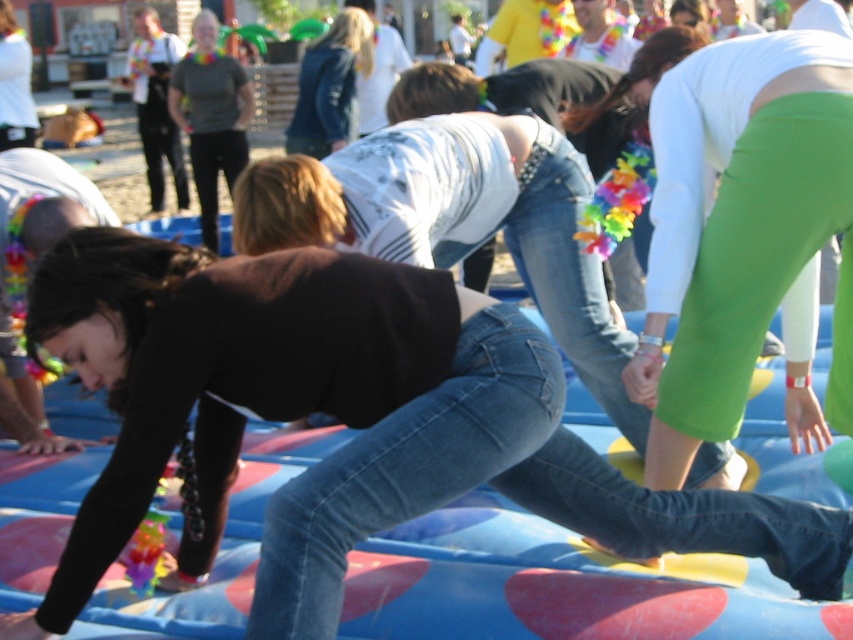
Which is above, green spandex pants at center or jeans at center?

green spandex pants at center is above.

Is green spandex pants at center to the right of jeans at center from the viewer's perspective?

Indeed, green spandex pants at center is positioned on the right side of jeans at center.

Is point (722, 264) in front of point (389, 506)?

No, it is behind (389, 506).

Locate an element on the screen. This screenshot has height=640, width=853. green spandex pants at center is located at coordinates (732, 218).

From the picture: Who is higher up, green spandex pants at center or denim jacket at center?

denim jacket at center

Who is more distant from viewer, (660,305) or (320,65)?

The point (320,65) is more distant.

Where is `green spandex pants at center`? This screenshot has height=640, width=853. green spandex pants at center is located at coordinates (732, 218).

Based on the photo, can you confirm if jeans at center is shorter than denim jacket at center?

Yes, jeans at center is shorter than denim jacket at center.

Can you confirm if jeans at center is bigger than denim jacket at center?

No.

Locate an element on the screen. jeans at center is located at coordinates (509, 486).

In order to click on jeans at center in this screenshot , I will do `click(509, 486)`.